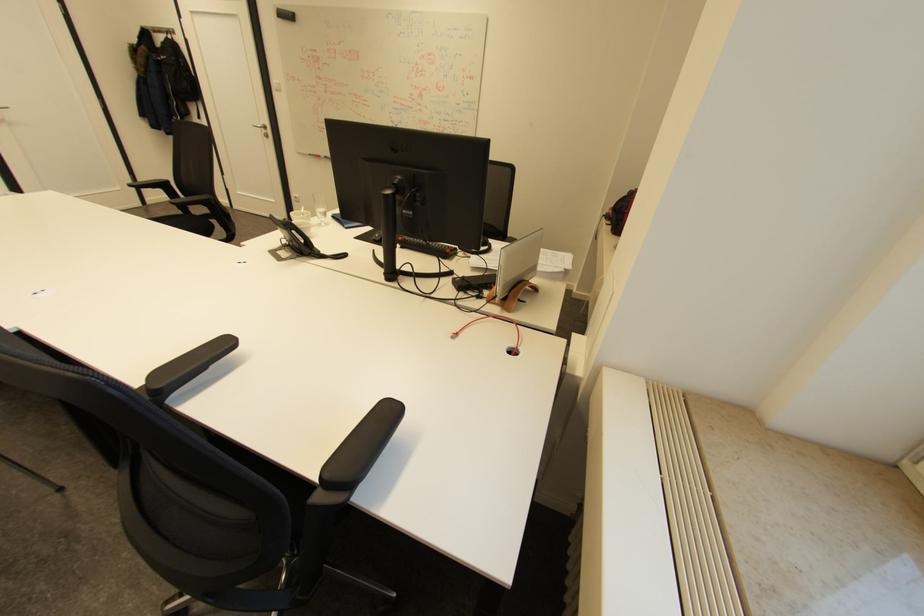
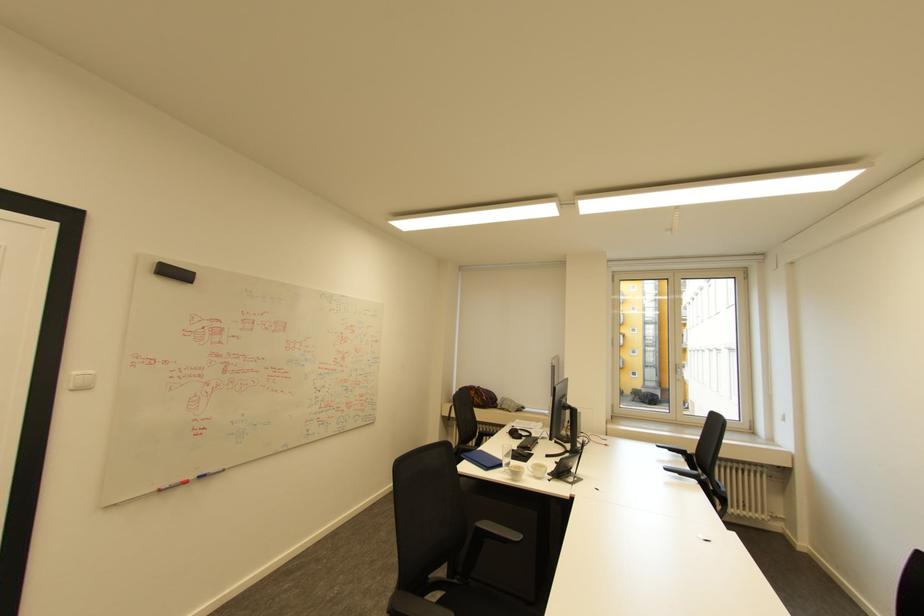
Locate, in the second image, the point that corresponds to the point at 315,154 in the first image.

(165, 490)